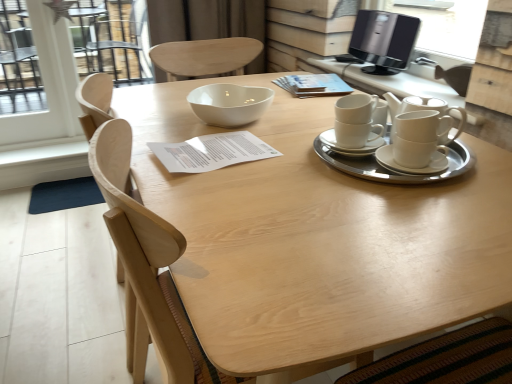
Question: From the image's perspective, is black glossy computer monitor at upper right located above or below white glossy bowl at center?

Choices:
 (A) above
 (B) below

Answer: (A)

Question: Based on their sizes in the image, would you say black glossy computer monitor at upper right is bigger or smaller than white glossy bowl at center?

Choices:
 (A) small
 (B) big

Answer: (B)

Question: Based on their relative distances, which object is nearer to the white ceramic cups at upper right, which appears as the first table when viewed from the top?

Choices:
 (A) white ceramic tea set at right
 (B) natural wood table at center, the 2th table viewed from the top
 (C) light wood chair at center
 (D) white glossy bowl at center
 (E) black glossy computer monitor at upper right

Answer: (E)

Question: Estimate the real-world distances between objects in this image. Which object is farther from the white ceramic tea set at right?

Choices:
 (A) natural wood table at center, which is the 1th table in bottom-to-top order
 (B) black glossy computer monitor at upper right
 (C) white ceramic saucer at right
 (D) light wood chair at center
 (E) white glossy bowl at center

Answer: (B)